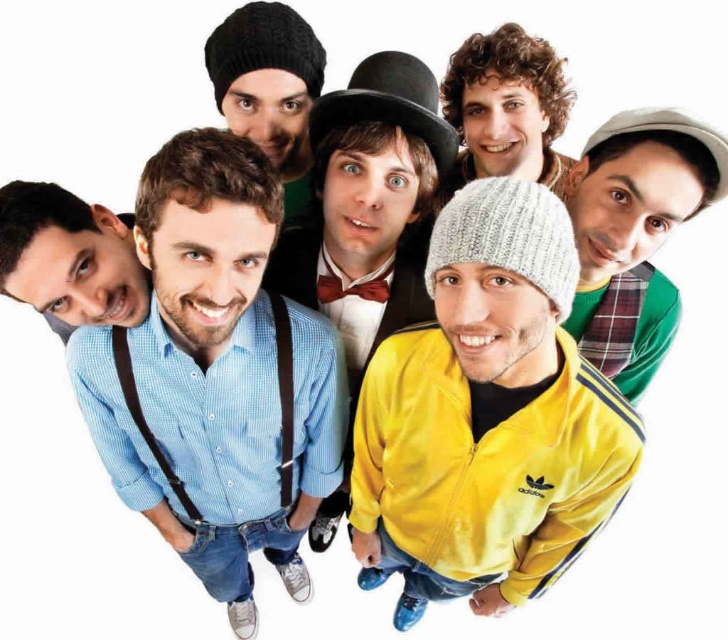
Question: Is blue checkered shirt at center to the left of yellow fabric jacket at center from the viewer's perspective?

Choices:
 (A) yes
 (B) no

Answer: (A)

Question: Which object is farther from the camera taking this photo?

Choices:
 (A) yellow matte jacket at center
 (B) blue checkered shirt at center
 (C) knit beanie at upper left

Answer: (C)

Question: Which point is closer to the camera?

Choices:
 (A) (293, 205)
 (B) (162, 243)
 (C) (609, 225)

Answer: (B)

Question: Does curly hair at upper center have a smaller size compared to knit beanie at upper left?

Choices:
 (A) yes
 (B) no

Answer: (A)

Question: Is curly hair at upper center further to the viewer compared to knit beanie at upper left?

Choices:
 (A) no
 (B) yes

Answer: (B)

Question: Which point is closer to the camera?

Choices:
 (A) (290, 257)
 (B) (601, 268)
 (C) (296, 208)

Answer: (B)